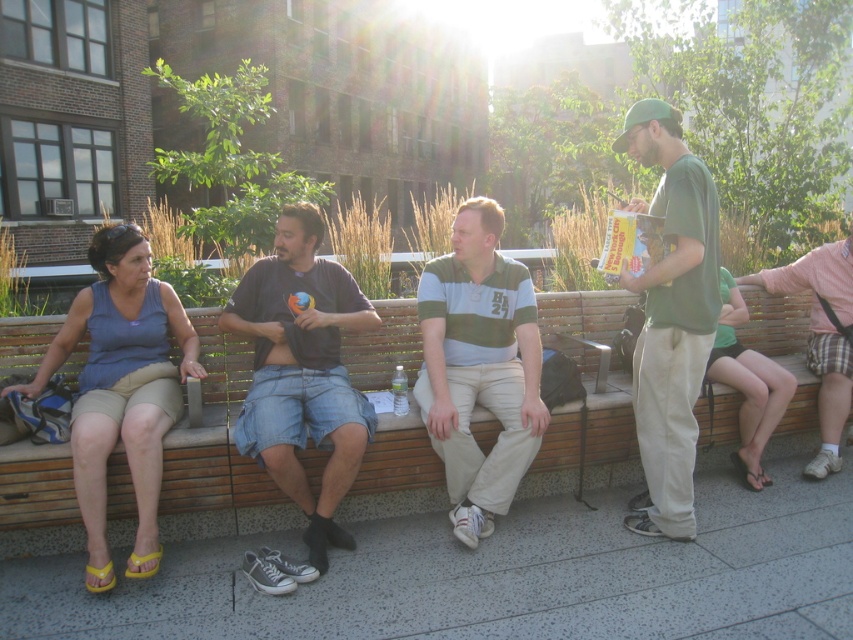
Question: Is denim shorts at center bigger than striped cotton polo shirt at center?

Choices:
 (A) yes
 (B) no

Answer: (A)

Question: Which point is farther to the camera?

Choices:
 (A) green fabric shorts at right
 (B) wooden bench at center
 (C) green cotton shirt at right
 (D) striped cotton polo shirt at center

Answer: (A)

Question: Among these objects, which one is nearest to the camera?

Choices:
 (A) striped cotton polo shirt at center
 (B) wooden bench at center
 (C) green cotton shirt at right
 (D) green fabric shorts at right

Answer: (C)

Question: Observing the image, what is the correct spatial positioning of striped cotton polo shirt at center in reference to green cotton shirt at right?

Choices:
 (A) below
 (B) above

Answer: (A)

Question: Where is wooden bench at center located in relation to denim shorts at center in the image?

Choices:
 (A) right
 (B) left

Answer: (B)

Question: Which point is closer to the camera?

Choices:
 (A) striped cotton polo shirt at center
 (B) green cotton shirt at right

Answer: (B)